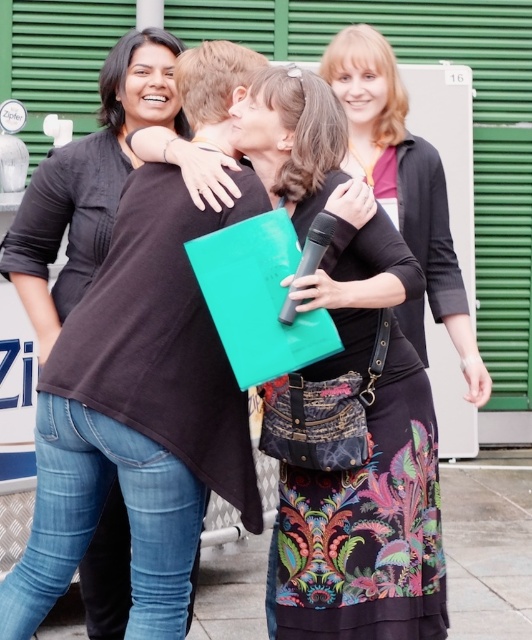
Between floral-patterned fabric dress at center and black plastic microphone at center, which one appears on the left side from the viewer's perspective?

black plastic microphone at center is more to the left.

Does floral-patterned fabric dress at center have a smaller size compared to black plastic microphone at center?

Actually, floral-patterned fabric dress at center might be larger than black plastic microphone at center.

Between point (290, 422) and point (320, 234), which one is positioned behind?

Positioned behind is point (290, 422).

Identify the location of floral-patterned fabric dress at center. The height and width of the screenshot is (640, 532). (334, 412).

Which is more to the right, black matte shirt at left or black plastic microphone at center?

From the viewer's perspective, black plastic microphone at center appears more on the right side.

Does point (167, 124) come closer to viewer compared to point (330, 218)?

No, it is not.

Where is `black matte shirt at left`? This screenshot has height=640, width=532. black matte shirt at left is located at coordinates (82, 189).

Can you confirm if smooth concrete pavement at lower center is thinner than floral-patterned fabric dress at center?

No.

Which of these two, smooth concrete pavement at lower center or floral-patterned fabric dress at center, stands shorter?

With less height is smooth concrete pavement at lower center.

Is point (476, 556) farther from camera compared to point (348, 380)?

Yes, point (476, 556) is behind point (348, 380).

Identify the location of smooth concrete pavement at lower center. (488, 545).